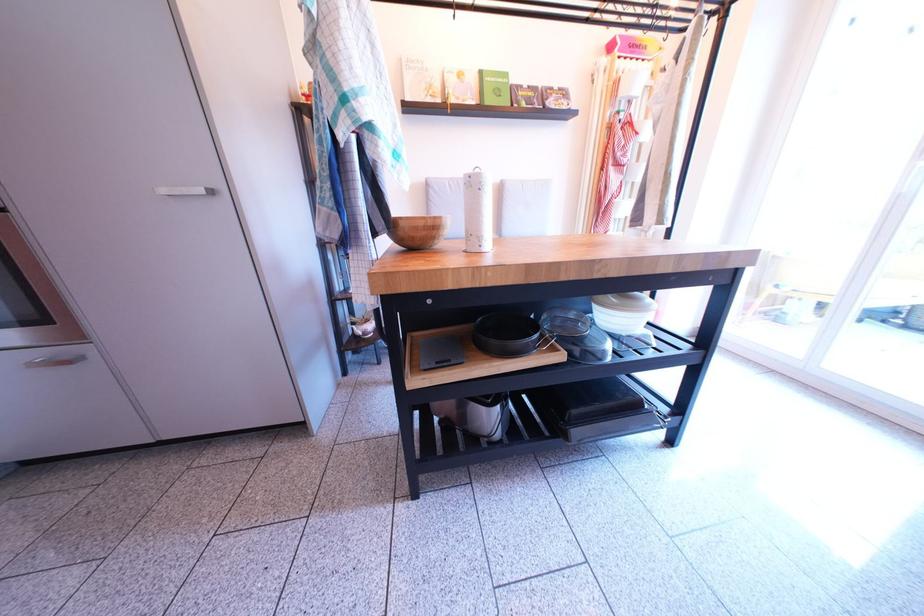
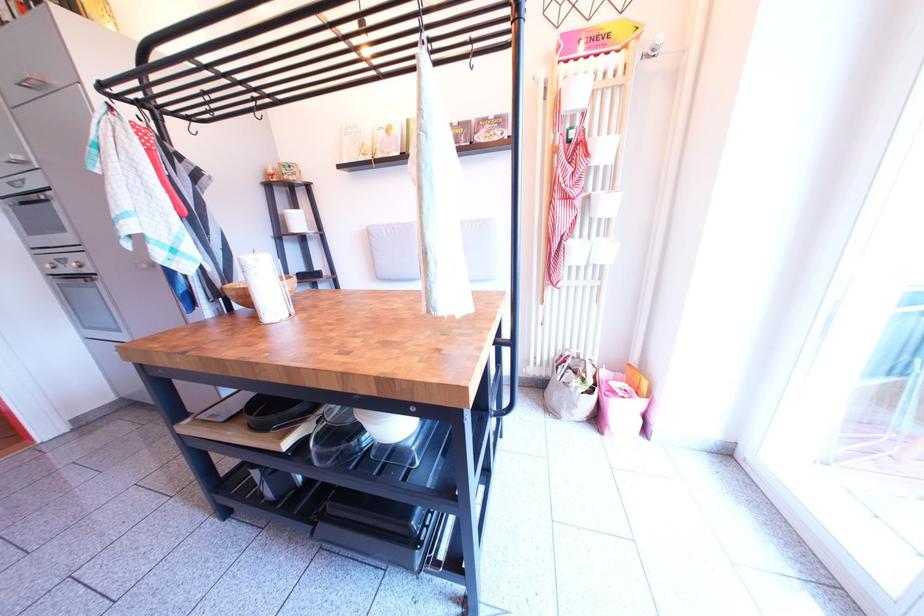
Question: What movement of the cameraman would produce the second image?

Choices:
 (A) Left
 (B) Right
 (C) Forward
 (D) Backward

Answer: (B)